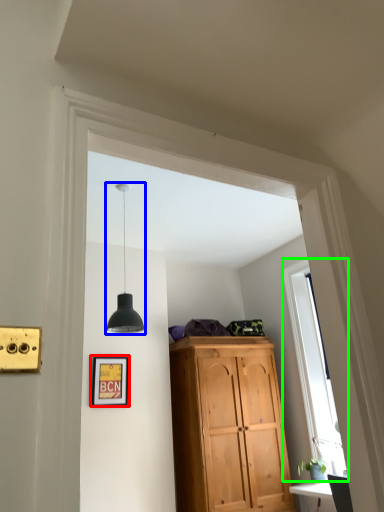
Question: Which object is the closest to the picture frame (highlighted by a red box)? Choose among these: light fixture (highlighted by a blue box) or window (highlighted by a green box).

Choices:
 (A) light fixture
 (B) window

Answer: (A)